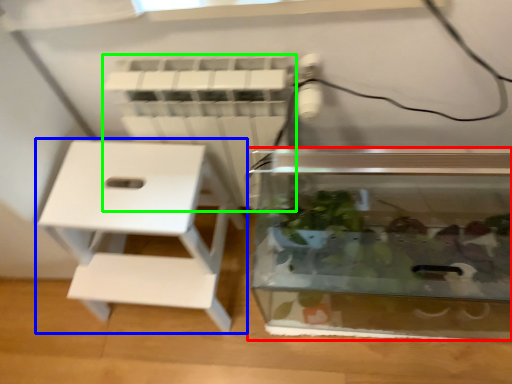
Question: Based on their relative distances, which object is farther from glass box (highlighted by a red box)? Choose from furniture (highlighted by a blue box) and radiator (highlighted by a green box).

Choices:
 (A) furniture
 (B) radiator

Answer: (A)